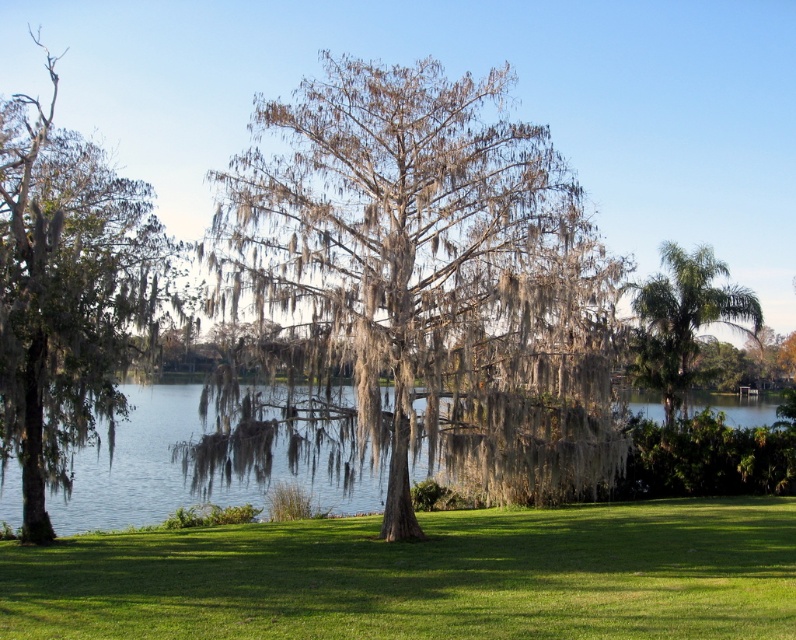
You are planning to set up a picnic blanket in the green grass at center. Considering the space available, will the green leafy palm at right be a problem for placing a standard picnic blanket that requires 3 meters of width?

The green grass at center has a larger width than the green leafy palm at right. Since the grass area is wider, it should accommodate a standard picnic blanket requiring 3 meters of width without interference from the palm tree.

You are standing at the point labeled point (x=654, y=577) and want to walk towards the point labeled point (x=6, y=483). Based on the scene description, which direction should you move to get closer to your destination?

You should move downward because point (x=654, y=577) is closer to the camera than point (x=6, y=483), which is further away. Moving downward would take you toward the lower part of the image where the destination point is located.